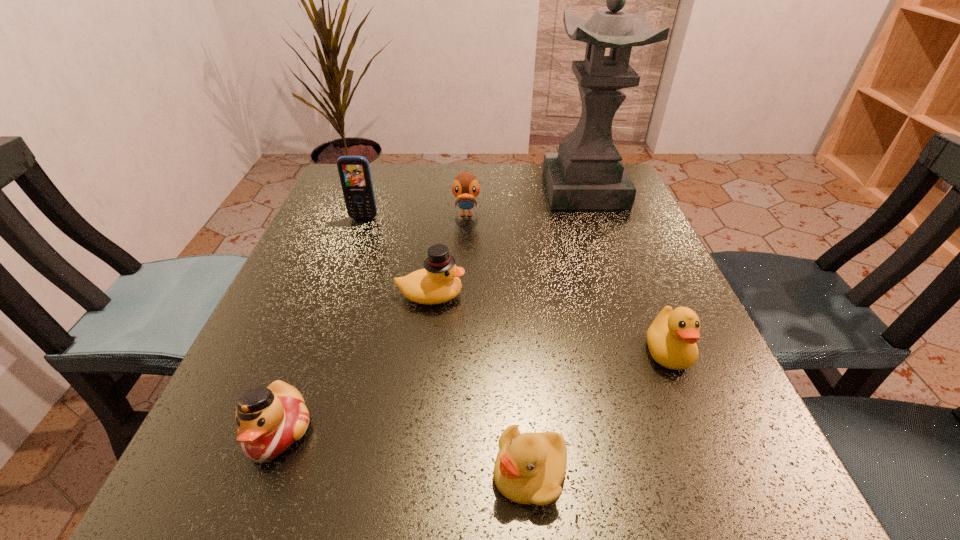
At what (x,y) coordinates should I click in order to perform the action: click on sculpture. Please return your answer as a coordinate pair (x, y). Looking at the image, I should click on (587, 172).

Where is `cellular telephone`? Image resolution: width=960 pixels, height=540 pixels. cellular telephone is located at coordinates (354, 171).

I want to click on the fourth farthest object, so click(x=438, y=282).

At what (x,y) coordinates should I click in order to perform the action: click on the rightmost duck. Please return your answer as a coordinate pair (x, y). The height and width of the screenshot is (540, 960). Looking at the image, I should click on (671, 338).

I want to click on the second nearest duck, so click(671, 338).

Identify the location of the farthest duck. (465, 187).

Locate an element on the screen. the nearest duck is located at coordinates (270, 420).

Identify the location of the fifth object from left to right. 529,469.

You are a GUI agent. You are given a task and a screenshot of the screen. Output one action in this format:
    pyautogui.click(x=<x>, y=<y>)
    Task: Click on the duckling
    This screenshot has width=960, height=540.
    Given the screenshot: What is the action you would take?
    pyautogui.click(x=529, y=469)

Where is `free space located at the front opening of the tallest object`? Image resolution: width=960 pixels, height=540 pixels. free space located at the front opening of the tallest object is located at coordinates (614, 274).